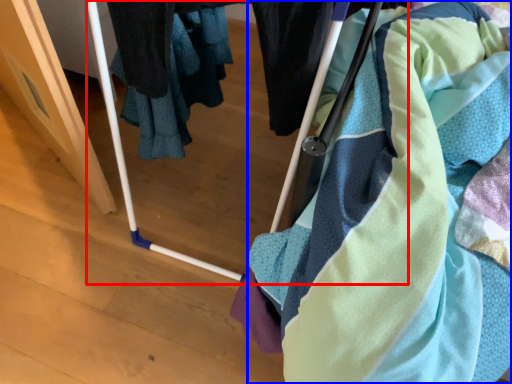
Question: Among these objects, which one is farthest to the camera, baby carriage (highlighted by a red box) or towel (highlighted by a blue box)?

Choices:
 (A) baby carriage
 (B) towel

Answer: (B)